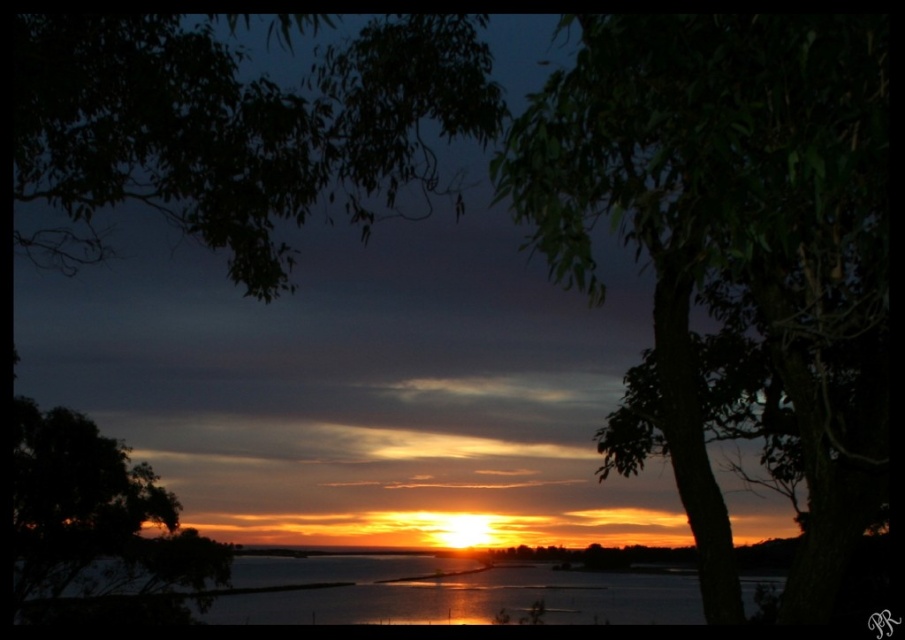
You are standing in the serene sunset scene and want to take a photo. You have two points marked in the image, point (x=116, y=26) and point (x=435, y=579). Which point will appear larger in your photo?

Point (x=116, y=26) is closer to the camera than point (x=435, y=579), so it will appear larger in the photo.

You are standing in the serene sunset scene and want to take a photo of the dark green leafy tree at upper left. Where should you position yourself to capture it in the upper left corner of your camera frame?

Position yourself so that the dark green leafy tree at upper left is centered at the coordinates corresponding to the point (232, 129) in the image to capture it in the upper left corner of your camera frame.